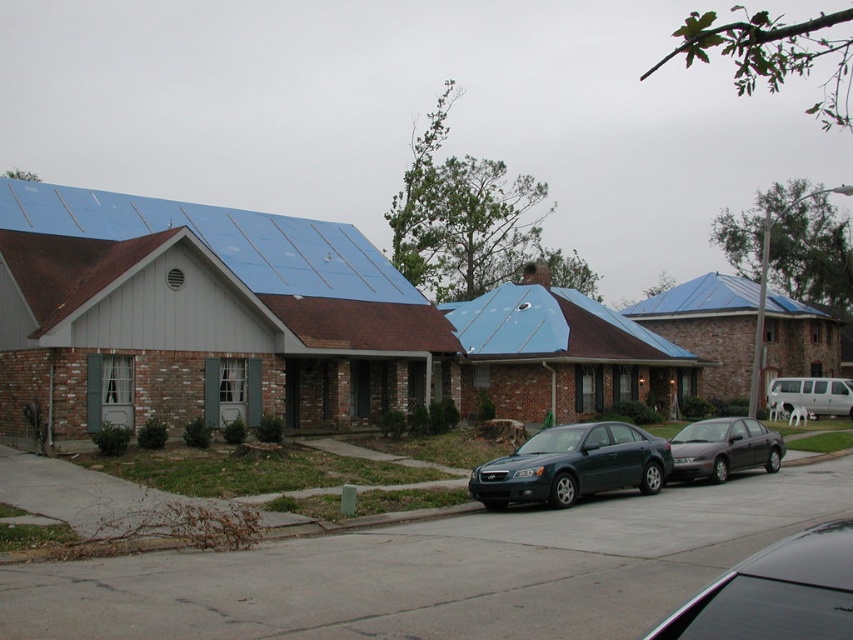
Question: Is blue metallic roof at center smaller than white matte van at center-right?

Choices:
 (A) yes
 (B) no

Answer: (B)

Question: Among these points, which one is nearest to the camera?

Choices:
 (A) (717, 477)
 (B) (679, 310)
 (C) (660, 636)

Answer: (C)

Question: Is the position of shiny black sedan at center more distant than that of matte black sedan at center?

Choices:
 (A) yes
 (B) no

Answer: (B)

Question: Which point is closer to the camera?

Choices:
 (A) white matte van at center-right
 (B) shiny black sedan at center

Answer: (B)

Question: Which object is the farthest from the blue solar panels at upper left?

Choices:
 (A) blue metallic roof at upper center
 (B) matte black sedan at center

Answer: (A)

Question: Does blue solar panels at upper left have a smaller size compared to metallic gray sedan at center?

Choices:
 (A) no
 (B) yes

Answer: (A)